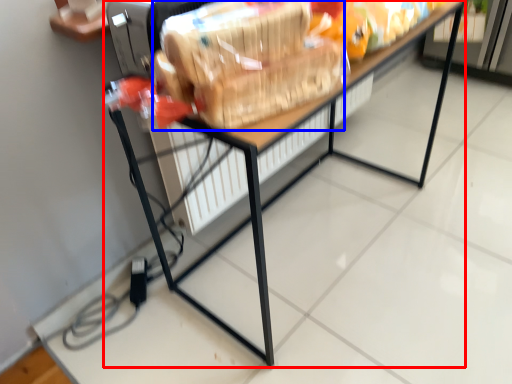
Question: Which of the following is the farthest to the observer, table (highlighted by a red box) or stuff (highlighted by a blue box)?

Choices:
 (A) table
 (B) stuff

Answer: (A)